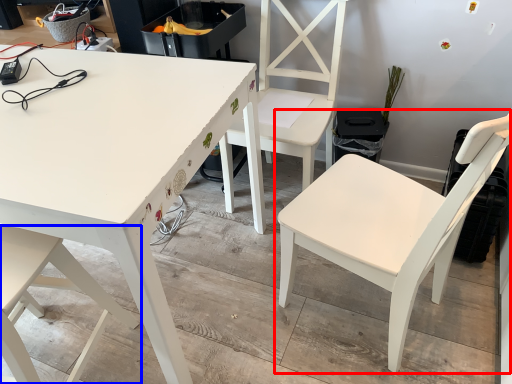
Question: Which object appears closest to the camera in this image, chair (highlighted by a red box) or chair (highlighted by a blue box)?

Choices:
 (A) chair
 (B) chair

Answer: (A)